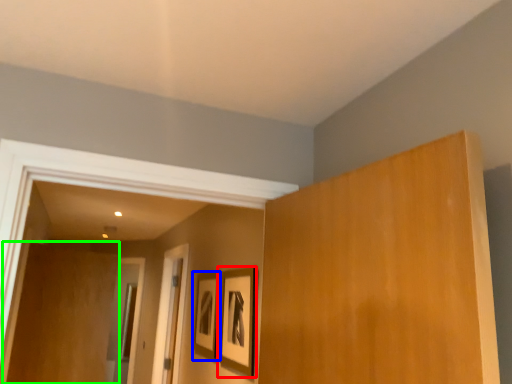
Question: Which object is the farthest from picture frame (highlighted by a red box)? Choose among these: picture frame (highlighted by a blue box) or plywood (highlighted by a green box).

Choices:
 (A) picture frame
 (B) plywood

Answer: (B)